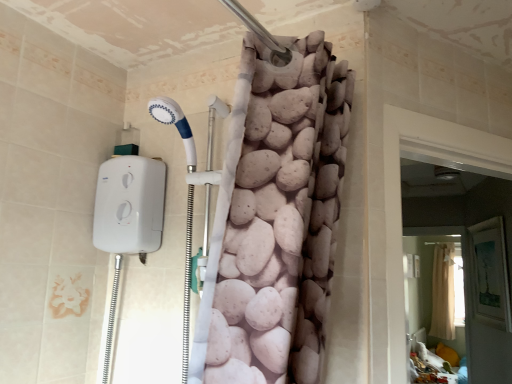
What do you see at coordinates (443, 292) in the screenshot? The width and height of the screenshot is (512, 384). I see `beige fabric shower curtain at upper center` at bounding box center [443, 292].

The width and height of the screenshot is (512, 384). Find the location of `beige fabric shower curtain at upper center`. beige fabric shower curtain at upper center is located at coordinates (443, 292).

Based on the photo, between white fabric screen door at right, acting as the second screen door starting from the right, and beige fabric shower curtain at upper center, which one is positioned in front?

white fabric screen door at right, acting as the second screen door starting from the right, is closer to the camera.

Can you confirm if white fabric screen door at right, acting as the second screen door starting from the right, is smaller than beige fabric shower curtain at upper center?

Yes.

From a real-world perspective, does white fabric screen door at right, acting as the second screen door starting from the right, stand above beige fabric shower curtain at upper center?

Yes, from a real-world perspective, white fabric screen door at right, acting as the second screen door starting from the right, is over beige fabric shower curtain at upper center

Is white fabric screen door at right, acting as the second screen door starting from the right, positioned far away from beige fabric shower curtain at upper center?

That's right, there is a large distance between white fabric screen door at right, acting as the second screen door starting from the right, and beige fabric shower curtain at upper center.

In the scene shown: How many degrees apart are the facing directions of beige fabric shower curtain at upper center and beige fabric screen door at lower right, the 2th screen door in the front-to-back sequence?

The facing directions of beige fabric shower curtain at upper center and beige fabric screen door at lower right, the 2th screen door in the front-to-back sequence, are 0.379 degrees apart.

Locate an element on the screen. The image size is (512, 384). screen door below the beige fabric shower curtain at upper center (from a real-world perspective) is located at coordinates (432, 282).

Is point (443, 302) farther from viewer compared to point (442, 242)?

Yes, point (443, 302) is farther from viewer.

How distant is beige fabric shower curtain at upper center from beige fabric screen door at lower right, the 2th screen door in the front-to-back sequence?

A distance of 5.76 inches exists between beige fabric shower curtain at upper center and beige fabric screen door at lower right, the 2th screen door in the front-to-back sequence.

This screenshot has height=384, width=512. Identify the location of shower curtain below the beige fabric screen door at lower right, which appears as the second screen door when viewed from the left (from the image's perspective). (443, 292).

How different are the orientations of beige fabric screen door at lower right, which is counted as the 1th screen door, starting from the right, and beige fabric shower curtain at upper center in degrees?

0.379 degrees.

Between beige fabric screen door at lower right, the 2th screen door in the front-to-back sequence, and beige fabric shower curtain at upper center, which one has larger size?

beige fabric shower curtain at upper center is bigger.

Which object is thinner, beige fabric screen door at lower right, the 2th screen door in the front-to-back sequence, or beige fabric shower curtain at upper center?

beige fabric screen door at lower right, the 2th screen door in the front-to-back sequence.

From a real-world perspective, which is physically below, beige fabric screen door at lower right, which appears as the second screen door when viewed from the left, or white fabric screen door at right, acting as the second screen door starting from the right?

beige fabric screen door at lower right, which appears as the second screen door when viewed from the left, is physically lower.

Is beige fabric screen door at lower right, which appears as the second screen door when viewed from the left, touching white fabric screen door at right, the 2th screen door from the back?

beige fabric screen door at lower right, which appears as the second screen door when viewed from the left, and white fabric screen door at right, the 2th screen door from the back, are clearly separated.

Does point (422, 292) come closer to viewer compared to point (399, 333)?

That is False.

Is beige fabric screen door at lower right, which appears as the second screen door when viewed from the left, turned away from white fabric screen door at right, the 2th screen door from the back?

No.

What's the angular difference between beige fabric shower curtain at upper center and white fabric screen door at right, placed as the first screen door when sorted from left to right,'s facing directions?

The angular difference between beige fabric shower curtain at upper center and white fabric screen door at right, placed as the first screen door when sorted from left to right, is 59.6 degrees.

Would you say beige fabric shower curtain at upper center is outside white fabric screen door at right, the 2th screen door from the back?

beige fabric shower curtain at upper center lies outside white fabric screen door at right, the 2th screen door from the back,'s area.

Considering the relative positions of beige fabric shower curtain at upper center and white fabric screen door at right, placed as the first screen door when sorted from left to right, in the image provided, is beige fabric shower curtain at upper center in front of white fabric screen door at right, placed as the first screen door when sorted from left to right,?

No, beige fabric shower curtain at upper center is further to the viewer.

From a real-world perspective, between beige fabric shower curtain at upper center and white fabric screen door at right, acting as the second screen door starting from the right, who is vertically higher?

In real-world perspective, white fabric screen door at right, acting as the second screen door starting from the right, is above.

Is beige fabric screen door at lower right, positioned as the first screen door in back-to-front order, located within white fabric screen door at right, acting as the second screen door starting from the right?

No, beige fabric screen door at lower right, positioned as the first screen door in back-to-front order, is not inside white fabric screen door at right, acting as the second screen door starting from the right.

Consider the image. Which object is positioned more to the left, white fabric screen door at right, the 2th screen door from the back, or beige fabric screen door at lower right, which appears as the second screen door when viewed from the left?

white fabric screen door at right, the 2th screen door from the back.

Which object is more forward, white fabric screen door at right, the 2th screen door from the back, or beige fabric screen door at lower right, the 2th screen door in the front-to-back sequence?

white fabric screen door at right, the 2th screen door from the back, is in front.

From a real-world perspective, is white fabric screen door at right, placed as the first screen door when sorted from left to right, positioned under beige fabric screen door at lower right, positioned as the first screen door in back-to-front order, based on gravity?

No, from a real-world perspective, white fabric screen door at right, placed as the first screen door when sorted from left to right, is not under beige fabric screen door at lower right, positioned as the first screen door in back-to-front order.

In the image, there is a white fabric screen door at right, placed as the 1th screen door when sorted from front to back. Identify the location of shower curtain below it (from a real-world perspective). This screenshot has height=384, width=512. (443, 292).

This screenshot has width=512, height=384. Find the location of `the 1st screen door counting from the left of the beige fabric shower curtain at upper center`. the 1st screen door counting from the left of the beige fabric shower curtain at upper center is located at coordinates (432, 282).

Looking at the image, which one is located further to beige fabric screen door at lower right, which is counted as the 1th screen door, starting from the right, beige fabric shower curtain at upper center or white fabric screen door at right, placed as the 1th screen door when sorted from front to back?

The object further to beige fabric screen door at lower right, which is counted as the 1th screen door, starting from the right, is white fabric screen door at right, placed as the 1th screen door when sorted from front to back.

From the image, which object appears to be nearer to beige fabric shower curtain at upper center, white fabric screen door at right, the 2th screen door from the back, or beige fabric screen door at lower right, the 2th screen door in the front-to-back sequence?

The object closer to beige fabric shower curtain at upper center is beige fabric screen door at lower right, the 2th screen door in the front-to-back sequence.

Which object lies nearer to the anchor point beige fabric screen door at lower right, which is counted as the 1th screen door, starting from the right, white fabric screen door at right, placed as the 1th screen door when sorted from front to back, or beige fabric shower curtain at upper center?

The object closer to beige fabric screen door at lower right, which is counted as the 1th screen door, starting from the right, is beige fabric shower curtain at upper center.

Which object lies further to the anchor point white fabric screen door at right, the 2th screen door from the back, beige fabric screen door at lower right, which appears as the second screen door when viewed from the left, or beige fabric shower curtain at upper center?

beige fabric shower curtain at upper center is positioned further to the anchor white fabric screen door at right, the 2th screen door from the back.

Based on their spatial positions, is beige fabric screen door at lower right, which appears as the second screen door when viewed from the left, or white fabric screen door at right, placed as the 1th screen door when sorted from front to back, further from beige fabric shower curtain at upper center?

white fabric screen door at right, placed as the 1th screen door when sorted from front to back, is further to beige fabric shower curtain at upper center.

Based on their spatial positions, is beige fabric shower curtain at upper center or beige fabric screen door at lower right, the 2th screen door in the front-to-back sequence, closer to white fabric screen door at right, placed as the first screen door when sorted from left to right?

beige fabric screen door at lower right, the 2th screen door in the front-to-back sequence, is closer to white fabric screen door at right, placed as the first screen door when sorted from left to right.

Where is `screen door located between white fabric screen door at right, the 2th screen door from the back, and beige fabric shower curtain at upper center in the depth direction`? This screenshot has height=384, width=512. screen door located between white fabric screen door at right, the 2th screen door from the back, and beige fabric shower curtain at upper center in the depth direction is located at coordinates (432, 282).